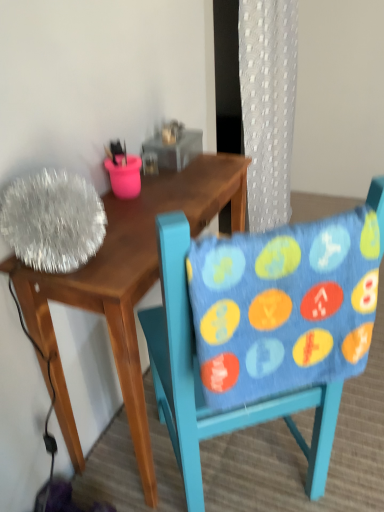
Image resolution: width=384 pixels, height=512 pixels. What do you see at coordinates (200, 380) in the screenshot?
I see `blue fabric chair at center` at bounding box center [200, 380].

This screenshot has width=384, height=512. I want to click on blue fabric pillow at center, so click(x=284, y=306).

Which of these two, blue fabric pillow at center or wooden desk at left, stands taller?

With more height is wooden desk at left.

From the picture: Which is more to the left, blue fabric pillow at center or wooden desk at left?

wooden desk at left is more to the left.

Is blue fabric pillow at center oriented away from wooden desk at left?

No.

Between blue fabric pillow at center and wooden desk at left, which one is positioned behind?

wooden desk at left is behind.

Which of these two, blue fabric chair at center or wooden desk at left, stands taller?

Standing taller between the two is blue fabric chair at center.

Is blue fabric chair at center turned away from wooden desk at left?

No, wooden desk at left is not at the back of blue fabric chair at center.

Locate an element on the screen. This screenshot has height=512, width=384. desk behind the blue fabric chair at center is located at coordinates (127, 285).

Which is farther, (x=173, y=405) or (x=89, y=262)?

The point (x=173, y=405) is farther.

In the scene shown: How distant is blue fabric chair at center from blue fabric pillow at center?

blue fabric chair at center and blue fabric pillow at center are 6.35 inches apart.

Is the surface of blue fabric chair at center in direct contact with blue fabric pillow at center?

They are not placed beside each other.

Considering the points (375, 191) and (276, 376), which point is in front, point (375, 191) or point (276, 376)?

The point (276, 376) is in front.

Consider the image. Is blue fabric chair at center positioned behind blue fabric pillow at center?

Yes, the depth of blue fabric chair at center is greater than that of blue fabric pillow at center.

Does blue fabric pillow at center touch blue fabric chair at center?

No, blue fabric pillow at center is not with blue fabric chair at center.

From a real-world perspective, is blue fabric pillow at center over blue fabric chair at center?

Yes, from a real-world perspective, blue fabric pillow at center is above blue fabric chair at center.

Is blue fabric pillow at center facing towards blue fabric chair at center?

Yes, blue fabric pillow at center is facing blue fabric chair at center.

Is blue fabric pillow at center shorter than blue fabric chair at center?

Yes.

Can you confirm if wooden desk at left is taller than blue fabric pillow at center?

Yes, wooden desk at left is taller than blue fabric pillow at center.

From the picture: Can you confirm if wooden desk at left is wider than blue fabric pillow at center?

Yes, wooden desk at left is wider than blue fabric pillow at center.

Measure the distance between wooden desk at left and blue fabric pillow at center.

wooden desk at left and blue fabric pillow at center are 33.77 centimeters apart.

Is wooden desk at left aimed at blue fabric pillow at center?

Yes, wooden desk at left is aimed at blue fabric pillow at center.

How far apart are wooden desk at left and blue fabric chair at center?

10.25 inches.

Between wooden desk at left and blue fabric chair at center, which one is positioned in front?

blue fabric chair at center is more forward.

Who is smaller, wooden desk at left or blue fabric chair at center?

With smaller size is wooden desk at left.

Locate an element on the screen. Image resolution: width=384 pixels, height=512 pixels. pillow on the right side of wooden desk at left is located at coordinates (284, 306).

Where is `desk that is above the blue fabric chair at center (from the image's perspective)`? The height and width of the screenshot is (512, 384). desk that is above the blue fabric chair at center (from the image's perspective) is located at coordinates (127, 285).

When comparing their distances from blue fabric pillow at center, does wooden desk at left or blue fabric chair at center seem closer?

blue fabric chair at center.

Consider the image. Which object lies further to the anchor point wooden desk at left, blue fabric pillow at center or blue fabric chair at center?

blue fabric pillow at center is positioned further to the anchor wooden desk at left.

Estimate the real-world distances between objects in this image. Which object is further from blue fabric chair at center, blue fabric pillow at center or wooden desk at left?

wooden desk at left is positioned further to the anchor blue fabric chair at center.

Which object lies further to the anchor point wooden desk at left, blue fabric chair at center or blue fabric pillow at center?

The object further to wooden desk at left is blue fabric pillow at center.

When comparing their distances from blue fabric pillow at center, does blue fabric chair at center or wooden desk at left seem further?

wooden desk at left is positioned further to the anchor blue fabric pillow at center.

Based on their spatial positions, is wooden desk at left or blue fabric pillow at center further from blue fabric chair at center?

wooden desk at left lies further to blue fabric chair at center than the other object.

Locate an element on the screen. The height and width of the screenshot is (512, 384). chair between blue fabric pillow at center and wooden desk at left along the z-axis is located at coordinates (200, 380).